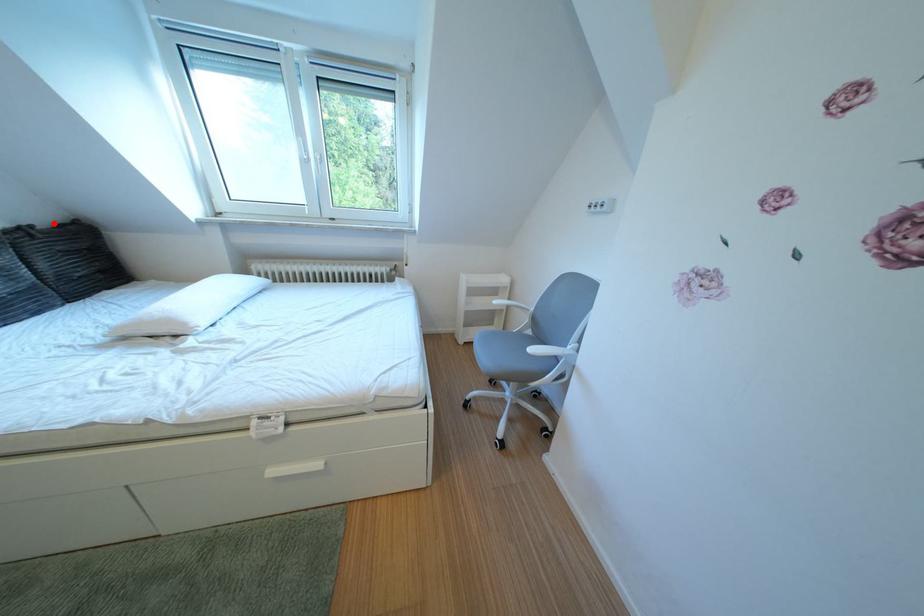
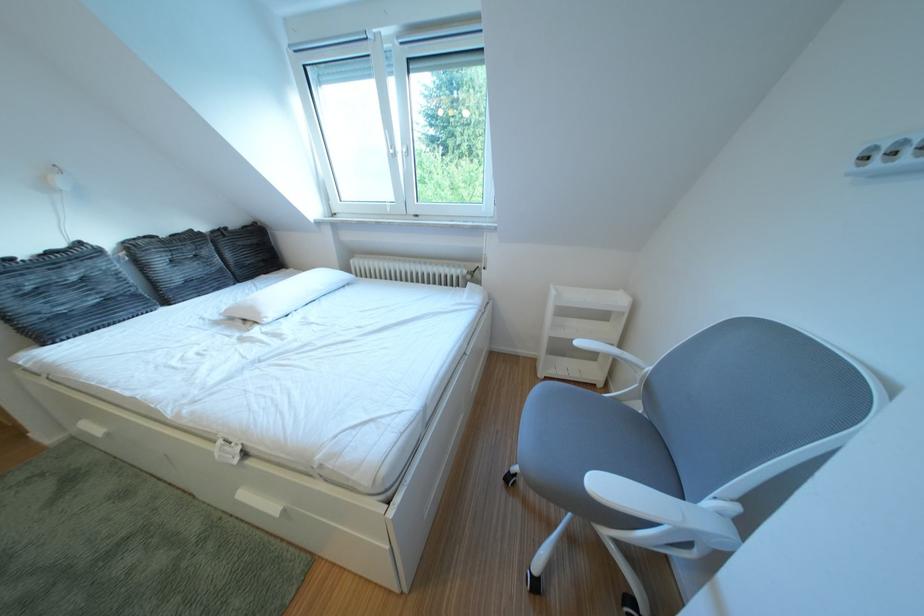
Question: I am providing you with two images of the same scene from different viewpoints. A red point is shown in image1. For the corresponding object point in image2, is it positioned nearer or farther from the camera?

Choices:
 (A) Nearer
 (B) Farther

Answer: (A)